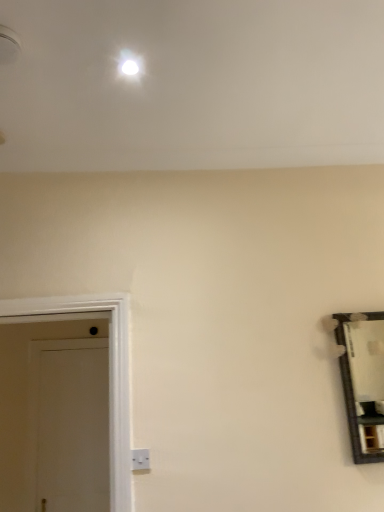
Question: From the image's perspective, is white plastic electric outlet at lower center positioned above or below white matte door at left?

Choices:
 (A) above
 (B) below

Answer: (A)

Question: In terms of height, does white plastic electric outlet at lower center look taller or shorter compared to white matte door at left?

Choices:
 (A) tall
 (B) short

Answer: (B)

Question: Considering the positions of white plastic electric outlet at lower center and white matte door at left in the image, is white plastic electric outlet at lower center wider or thinner than white matte door at left?

Choices:
 (A) wide
 (B) thin

Answer: (B)

Question: In the image, is white matte door at left positioned in front of or behind white plastic electric outlet at lower center?

Choices:
 (A) front
 (B) behind

Answer: (B)

Question: Would you say white matte door at left is inside or outside white plastic electric outlet at lower center?

Choices:
 (A) inside
 (B) outside

Answer: (B)

Question: Looking at their shapes, would you say white matte door at left is wider or thinner than white plastic electric outlet at lower center?

Choices:
 (A) thin
 (B) wide

Answer: (B)

Question: Is white matte door at left taller or shorter than white plastic electric outlet at lower center?

Choices:
 (A) short
 (B) tall

Answer: (B)